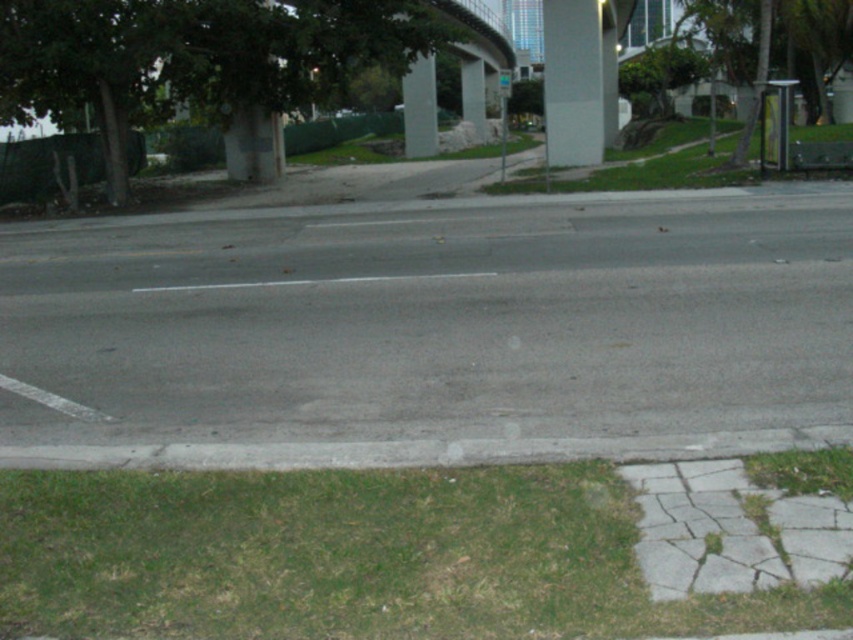
Question: Is gray asphalt pavement at center further to the viewer compared to white glossy sign at center?

Choices:
 (A) no
 (B) yes

Answer: (A)

Question: Which object appears farthest from the camera in this image?

Choices:
 (A) concrete pillar at center
 (B) gray concrete pillar at center
 (C) green grass at upper right
 (D) white plastic sign at upper center

Answer: (A)

Question: Observing the image, what is the correct spatial positioning of green grass at lower left in reference to white glossy sign at center?

Choices:
 (A) above
 (B) below

Answer: (B)

Question: Which object is the farthest from the white glossy sign at center?

Choices:
 (A) green grass at upper right
 (B) gray concrete pillar at center

Answer: (A)

Question: Which point is farther to the camera?

Choices:
 (A) (329, 476)
 (B) (479, 67)

Answer: (B)

Question: Does gray concrete curb at lower center appear over green grass at upper right?

Choices:
 (A) no
 (B) yes

Answer: (A)